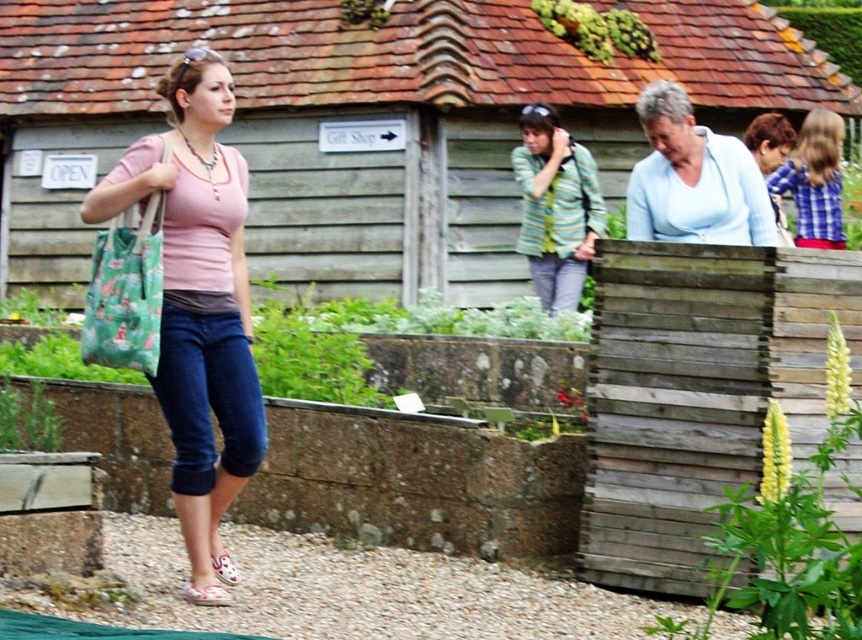
Question: Which point is closer to the camera?

Choices:
 (A) (54, 282)
 (B) (554, 176)
 (C) (125, 163)

Answer: (C)

Question: Is matte pink shirt at center to the right of plaid shirt at upper right from the viewer's perspective?

Choices:
 (A) yes
 (B) no

Answer: (B)

Question: Is wooden fence at center bigger than striped fabric jacket at center?

Choices:
 (A) yes
 (B) no

Answer: (A)

Question: Which object is positioned closest to the matte pink shirt at center?

Choices:
 (A) striped fabric jacket at center
 (B) plaid shirt at upper right

Answer: (B)

Question: Among these points, which one is nearest to the camera?

Choices:
 (A) (192, 528)
 (B) (815, 225)
 (C) (3, 273)
 (D) (585, 220)

Answer: (A)

Question: Considering the relative positions of wooden fence at center and plaid shirt at upper right in the image provided, where is wooden fence at center located with respect to plaid shirt at upper right?

Choices:
 (A) left
 (B) right

Answer: (A)